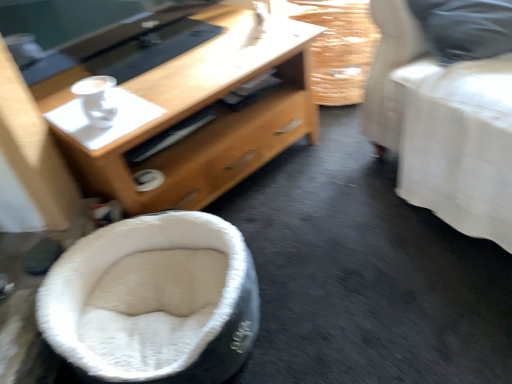
Image resolution: width=512 pixels, height=384 pixels. I want to click on vacant area that lies to the right of white glossy cup at upper left, so click(x=170, y=103).